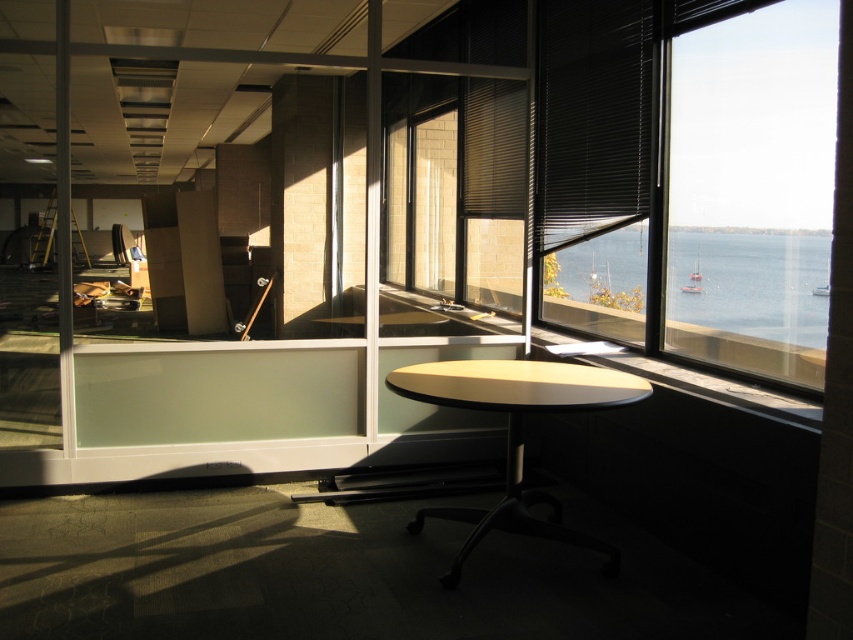
Question: Estimate the real-world distances between objects in this image. Which object is farther from the blue water at window right?

Choices:
 (A) transparent glass window at right
 (B) light beige laminate table at center

Answer: (B)

Question: Is blue water at window right wider than light beige laminate table at center?

Choices:
 (A) yes
 (B) no

Answer: (B)

Question: Can you confirm if transparent glass window at right is positioned to the right of light beige laminate table at center?

Choices:
 (A) no
 (B) yes

Answer: (B)

Question: Which point is closer to the camera?

Choices:
 (A) (718, 296)
 (B) (727, 292)

Answer: (B)

Question: Which point is farther from the camera taking this photo?

Choices:
 (A) (547, 502)
 (B) (717, 84)

Answer: (B)

Question: Does blue water at window right have a greater width compared to light beige laminate table at center?

Choices:
 (A) yes
 (B) no

Answer: (B)